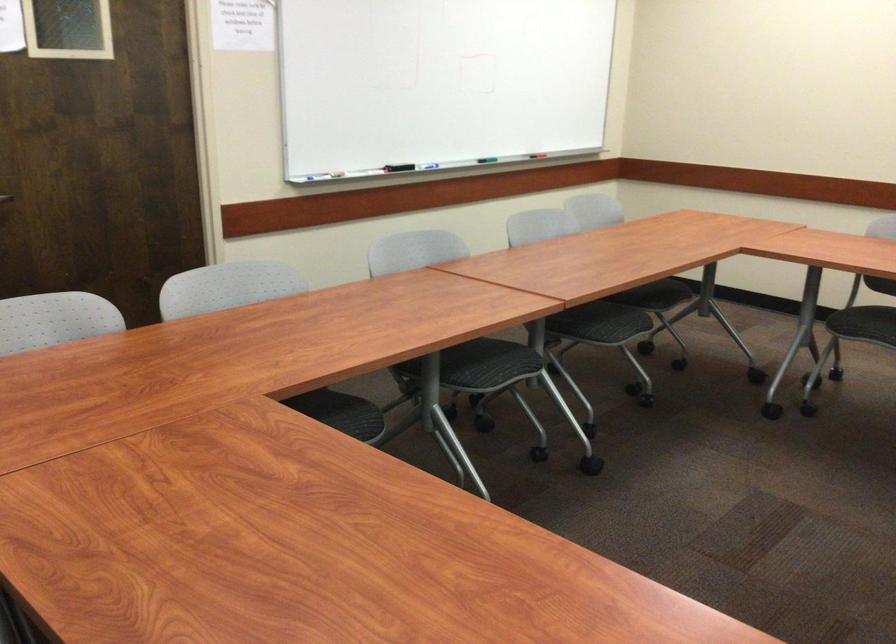
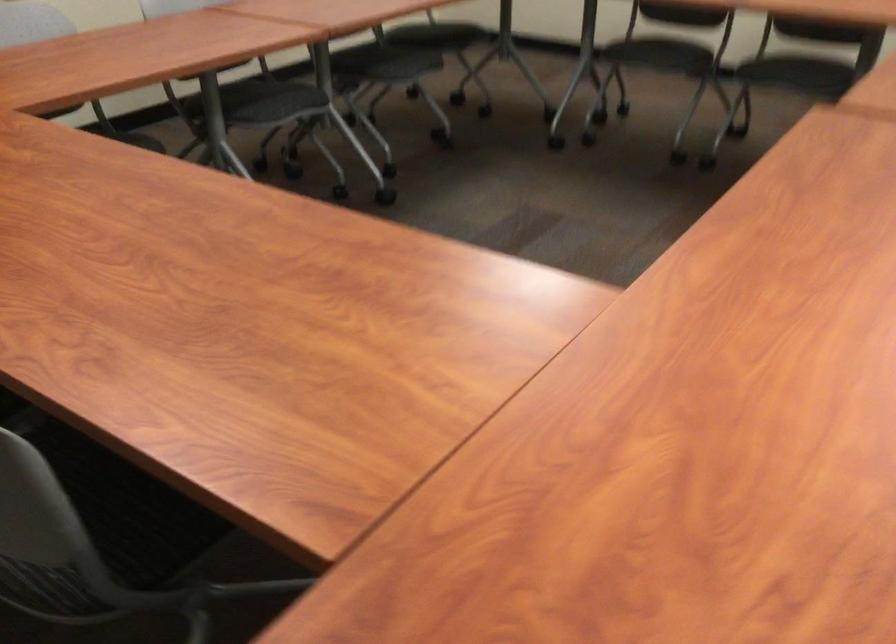
Question: The first image is from the beginning of the video and the second image is from the end. How did the camera likely rotate when shooting the video?

Choices:
 (A) Left
 (B) Right
 (C) Up
 (D) Down

Answer: (D)